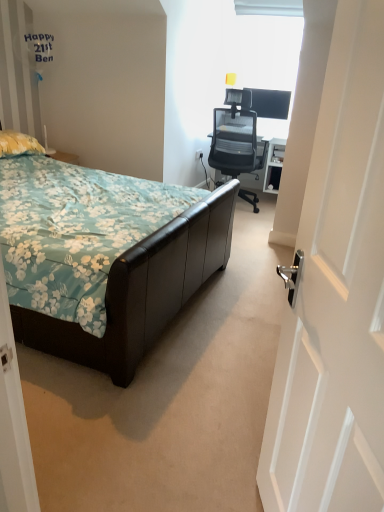
Question: Can you confirm if transparent glass window at upper center is taller than leather bed at left?

Choices:
 (A) yes
 (B) no

Answer: (B)

Question: Is leather bed at left at the back of transparent glass window at upper center?

Choices:
 (A) yes
 (B) no

Answer: (B)

Question: Does transparent glass window at upper center have a larger size compared to leather bed at left?

Choices:
 (A) yes
 (B) no

Answer: (B)

Question: Is the position of transparent glass window at upper center less distant than that of leather bed at left?

Choices:
 (A) no
 (B) yes

Answer: (A)

Question: Is transparent glass window at upper center directly adjacent to leather bed at left?

Choices:
 (A) yes
 (B) no

Answer: (B)

Question: Is transparent glass window at upper center shorter than leather bed at left?

Choices:
 (A) yes
 (B) no

Answer: (A)

Question: Is matte black monitor at upper right shorter than black mesh office chair at upper right?

Choices:
 (A) yes
 (B) no

Answer: (A)

Question: Is matte black monitor at upper right to the left of black mesh office chair at upper right from the viewer's perspective?

Choices:
 (A) yes
 (B) no

Answer: (B)

Question: Could black mesh office chair at upper right be considered to be inside matte black monitor at upper right?

Choices:
 (A) no
 (B) yes

Answer: (A)

Question: Are matte black monitor at upper right and black mesh office chair at upper right making contact?

Choices:
 (A) yes
 (B) no

Answer: (B)

Question: Does matte black monitor at upper right have a smaller size compared to black mesh office chair at upper right?

Choices:
 (A) yes
 (B) no

Answer: (A)

Question: Does matte black monitor at upper right have a greater width compared to black mesh office chair at upper right?

Choices:
 (A) yes
 (B) no

Answer: (B)

Question: From the image's perspective, is yellow fabric pillow at left beneath leather bed at left?

Choices:
 (A) no
 (B) yes

Answer: (A)